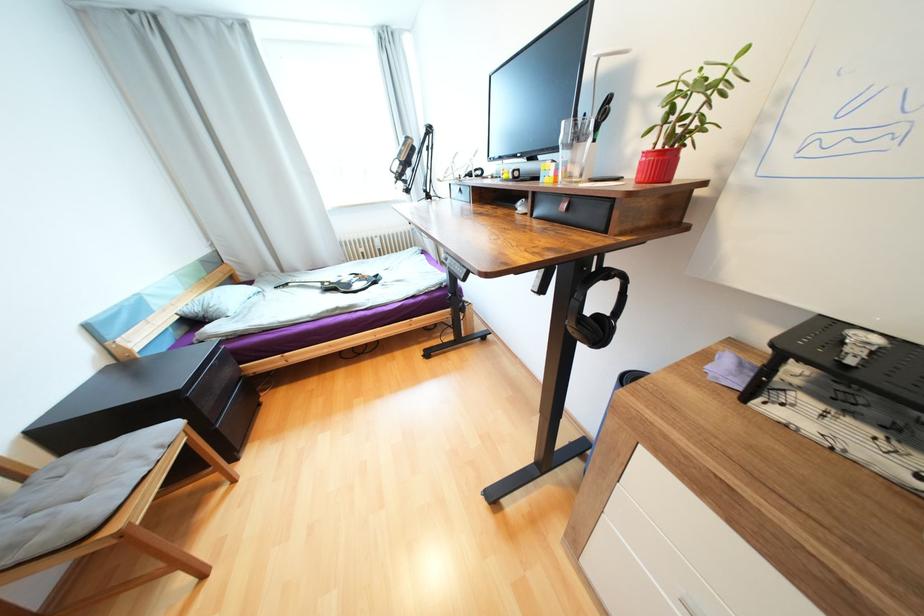
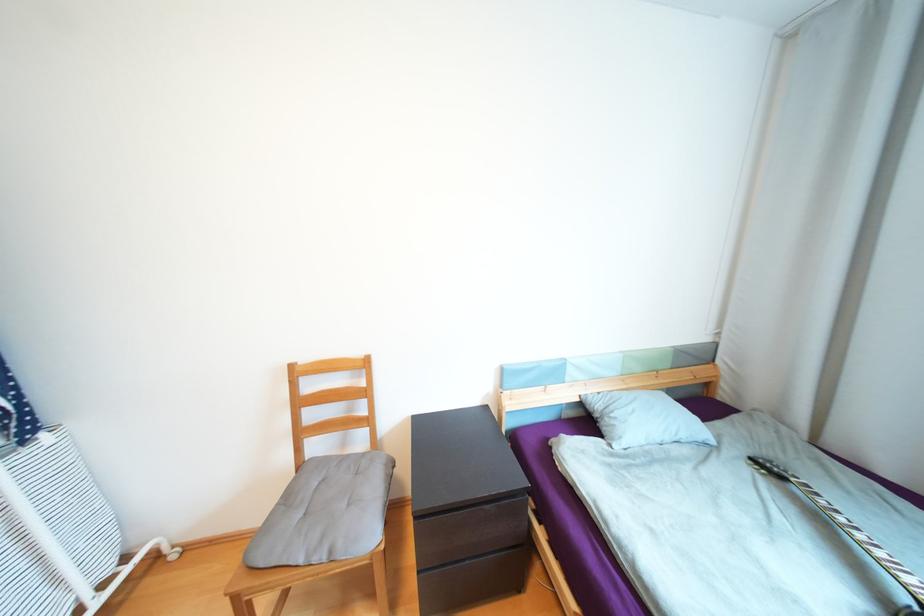
Find the pixel in the second image that matches point (293, 285) in the first image.

(787, 477)